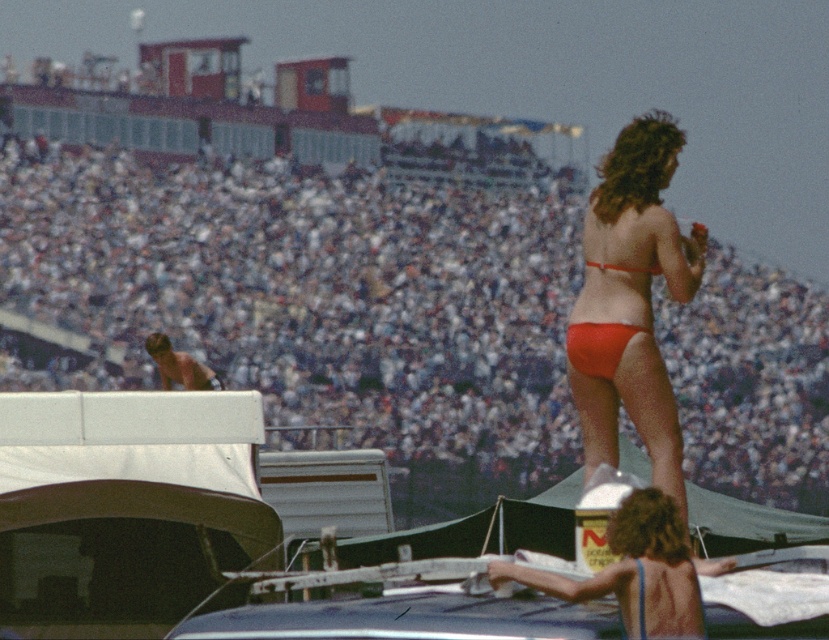
Question: Which is nearer to the matte red bikini bottom at center?

Choices:
 (A) matte orange bikini top at upper right
 (B) white cotton crowd at upper center
 (C) orange matte bikini bottom at upper right

Answer: (A)

Question: Which point is closer to the camera?

Choices:
 (A) (638, 269)
 (B) (602, 266)
 (C) (571, 362)

Answer: (B)

Question: Does white cotton crowd at upper center lie in front of orange matte bikini bottom at upper right?

Choices:
 (A) no
 (B) yes

Answer: (A)

Question: Which object appears farthest from the camera in this image?

Choices:
 (A) matte orange bikini top at upper right
 (B) white cotton crowd at upper center

Answer: (A)

Question: Can you confirm if white cotton crowd at upper center is smaller than matte orange bikini top at upper right?

Choices:
 (A) yes
 (B) no

Answer: (B)

Question: Where is orange matte bikini bottom at upper right located in relation to matte red bikini bottom at center in the image?

Choices:
 (A) right
 (B) left

Answer: (A)